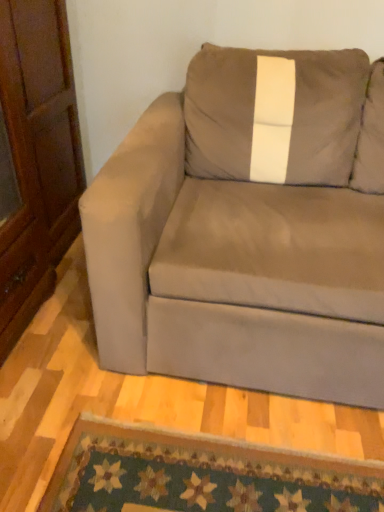
Locate an element on the screen. Image resolution: width=384 pixels, height=512 pixels. suede-like beige couch at center is located at coordinates (248, 229).

Image resolution: width=384 pixels, height=512 pixels. What do you see at coordinates (248, 229) in the screenshot? I see `suede-like beige couch at center` at bounding box center [248, 229].

The height and width of the screenshot is (512, 384). In order to click on suede-like beige couch at center in this screenshot , I will do `click(248, 229)`.